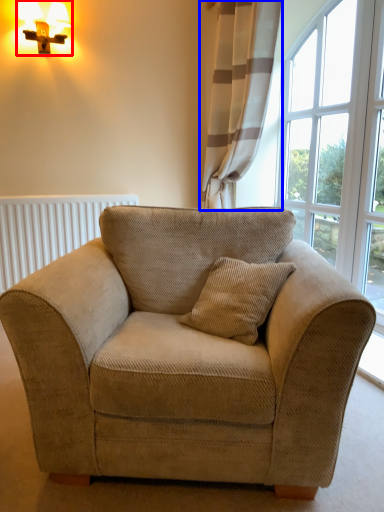
Question: Which of the following is the farthest to the observer, table lamp (highlighted by a red box) or curtain (highlighted by a blue box)?

Choices:
 (A) table lamp
 (B) curtain

Answer: (A)